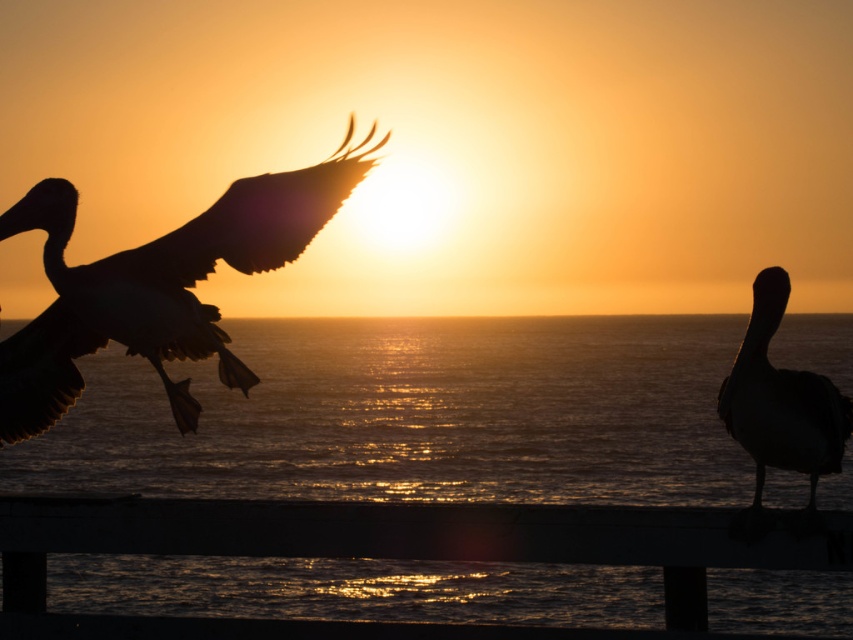
Can you confirm if shiny metallic water at center is positioned to the right of silhouette matte bird at right?

Incorrect, shiny metallic water at center is not on the right side of silhouette matte bird at right.

Is shiny metallic water at center to the left of silhouette matte bird at right from the viewer's perspective?

Indeed, shiny metallic water at center is positioned on the left side of silhouette matte bird at right.

Which is behind, point (593, 486) or point (827, 438)?

Point (593, 486)

The height and width of the screenshot is (640, 853). I want to click on shiny metallic water at center, so click(418, 416).

Is smooth wood rail at lower center bigger than silhouette matte bird at right?

Yes.

Does smooth wood rail at lower center appear on the left side of silhouette matte bird at right?

Indeed, smooth wood rail at lower center is positioned on the left side of silhouette matte bird at right.

At what (x,y) coordinates should I click in order to perform the action: click on smooth wood rail at lower center. Please return your answer as a coordinate pair (x, y). Image resolution: width=853 pixels, height=640 pixels. Looking at the image, I should click on [x=389, y=554].

Where is `smooth wood rail at lower center`? This screenshot has height=640, width=853. smooth wood rail at lower center is located at coordinates (389, 554).

Is smooth wood rail at lower center behind silhouette feathered bird at left?

No, it is in front of silhouette feathered bird at left.

Can you confirm if smooth wood rail at lower center is shorter than silhouette feathered bird at left?

Yes, smooth wood rail at lower center is shorter than silhouette feathered bird at left.

Describe the element at coordinates (389, 554) in the screenshot. The image size is (853, 640). I see `smooth wood rail at lower center` at that location.

The width and height of the screenshot is (853, 640). What are the coordinates of `smooth wood rail at lower center` in the screenshot? It's located at (389, 554).